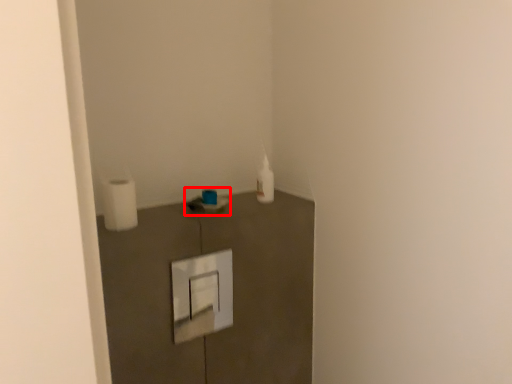
Question: In this image, where is sink (annotated by the red box) located relative to toilet paper?

Choices:
 (A) right
 (B) left

Answer: (A)